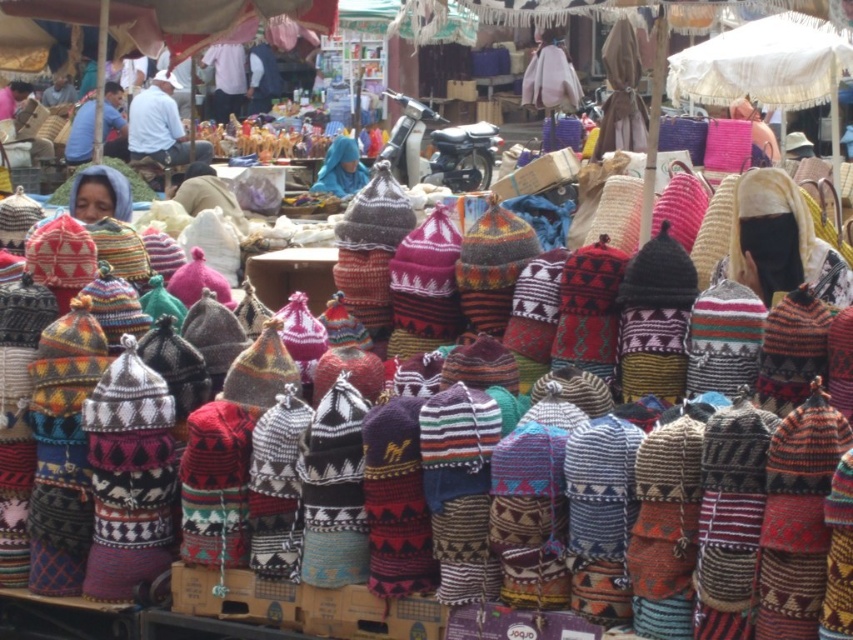
Question: Is matte blue shirt at upper left closer to camera compared to blue knitted hat at center?

Choices:
 (A) no
 (B) yes

Answer: (B)

Question: Which point is farther from the camera taking this photo?

Choices:
 (A) (169, 118)
 (B) (76, 116)
 (C) (325, 160)

Answer: (B)

Question: Among these points, which one is farthest from the camera?

Choices:
 (A) (154, 81)
 (B) (90, 104)

Answer: (A)

Question: Estimate the real-world distances between objects in this image. Which object is closer to the light blue cotton shirt at center?

Choices:
 (A) matte blue shirt at upper left
 (B) blue knitted hat at center

Answer: (A)

Question: Is light blue cotton shirt at center smaller than blue knitted hat at center?

Choices:
 (A) yes
 (B) no

Answer: (B)

Question: Is light blue cotton shirt at center above matte blue shirt at upper left?

Choices:
 (A) yes
 (B) no

Answer: (A)